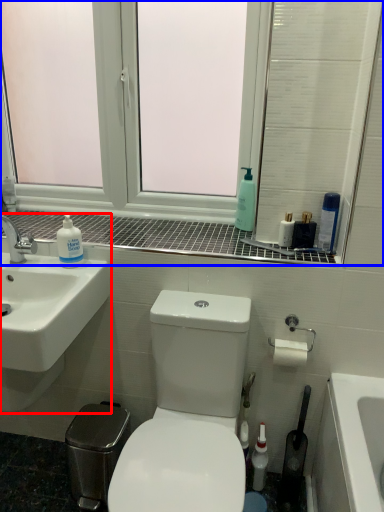
Question: Which point is closer to the camera, sink (highlighted by a red box) or window (highlighted by a blue box)?

Choices:
 (A) sink
 (B) window

Answer: (A)